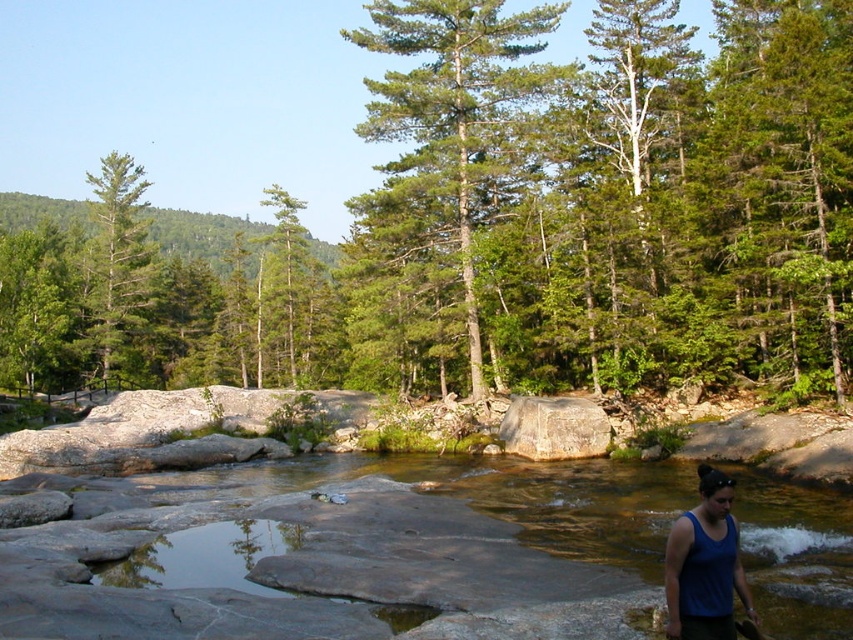
Measure the distance between point (724, 157) and camera.

Point (724, 157) is 102.93 feet away from camera.

Can you confirm if green matte tree at center is positioned below clear water at center?

Incorrect, green matte tree at center is not positioned below clear water at center.

You are a GUI agent. You are given a task and a screenshot of the screen. Output one action in this format:
    pyautogui.click(x=<x>, y=<y>)
    Task: Click on the green matte tree at center
    This screenshot has width=853, height=640.
    Given the screenshot: What is the action you would take?
    pyautogui.click(x=509, y=221)

Between point (579, 602) and point (463, 202), which one is positioned in front?

Positioned in front is point (579, 602).

From the picture: Is clear water at center bigger than green textured tree at center?

Incorrect, clear water at center is not larger than green textured tree at center.

You are a GUI agent. You are given a task and a screenshot of the screen. Output one action in this format:
    pyautogui.click(x=<x>, y=<y>)
    Task: Click on the clear water at center
    The height and width of the screenshot is (640, 853).
    Given the screenshot: What is the action you would take?
    pyautogui.click(x=306, y=564)

Describe the element at coordinates (119, 259) in the screenshot. The image size is (853, 640). I see `green matte tree at left` at that location.

Is green matte tree at left thinner than blue fabric tank top at lower right?

Incorrect, green matte tree at left's width is not less than blue fabric tank top at lower right's.

What are the coordinates of `green matte tree at left` in the screenshot? It's located at (119, 259).